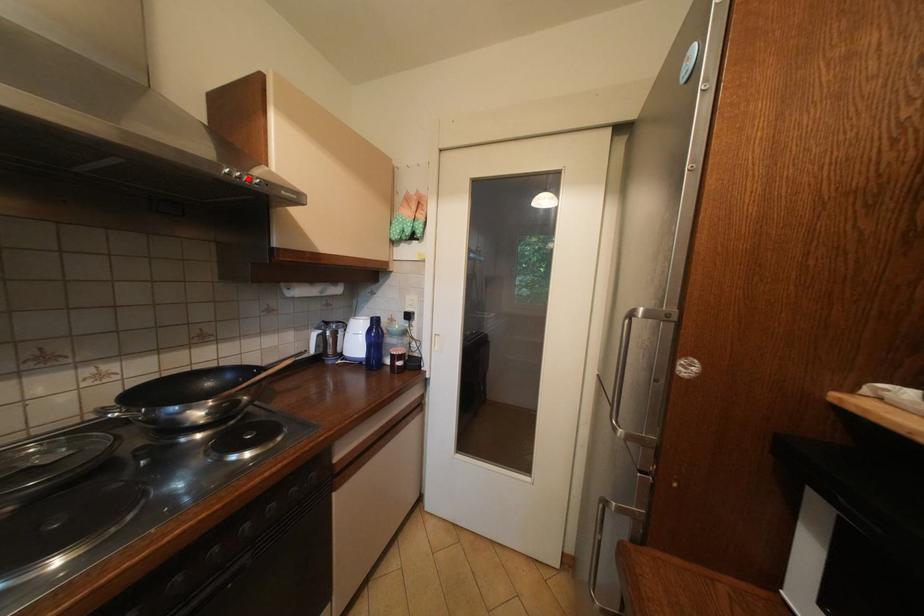
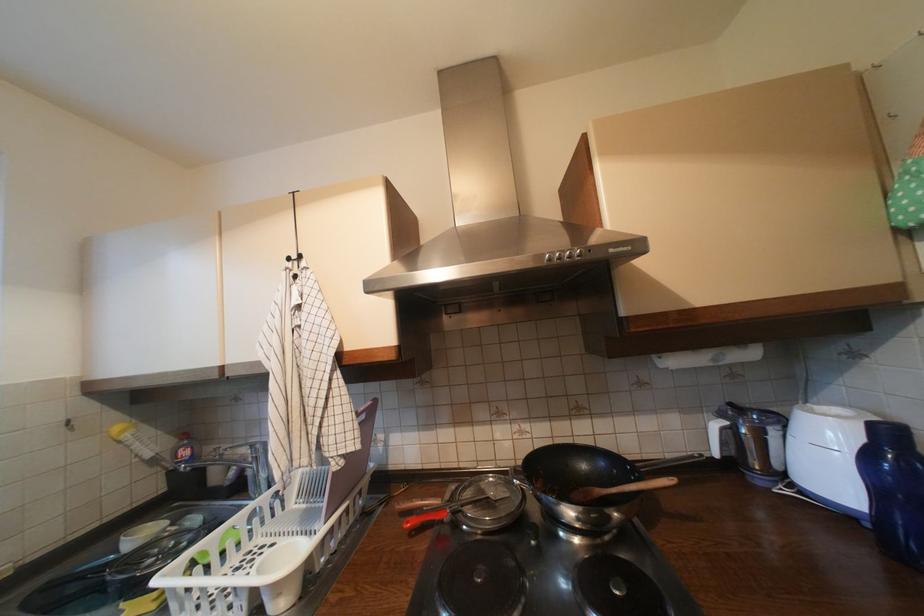
Find the pixel in the second image that matches the highlighted location in the first image.

(568, 259)